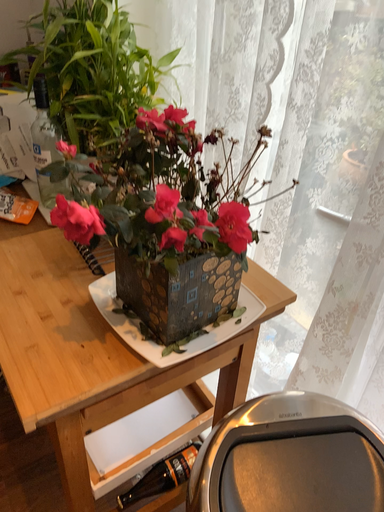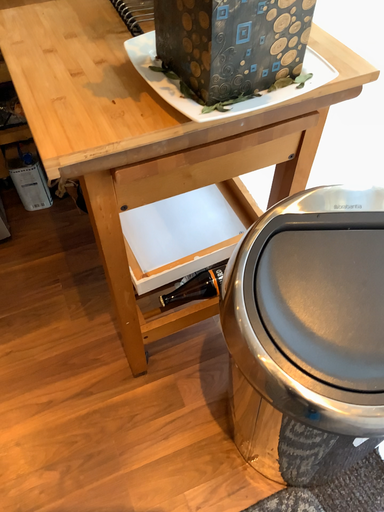
Question: How did the camera likely rotate when shooting the video?

Choices:
 (A) rotated left
 (B) rotated right

Answer: (A)